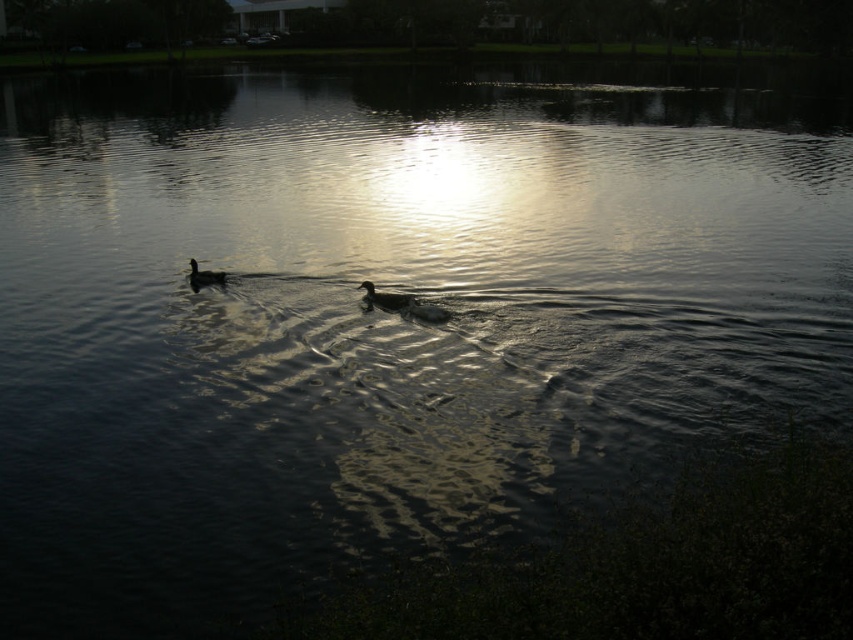
Question: From the image, what is the correct spatial relationship of dark brown feathers at center in relation to dark brown feathers at left?

Choices:
 (A) left
 (B) right

Answer: (B)

Question: Which point is farther to the camera?

Choices:
 (A) dark brown feathers at center
 (B) dark brown feathers at left

Answer: (B)

Question: Does dark brown feathers at center have a larger size compared to dark brown feathers at left?

Choices:
 (A) no
 (B) yes

Answer: (B)

Question: Can you confirm if dark brown feathers at center is smaller than dark brown feathers at left?

Choices:
 (A) no
 (B) yes

Answer: (A)